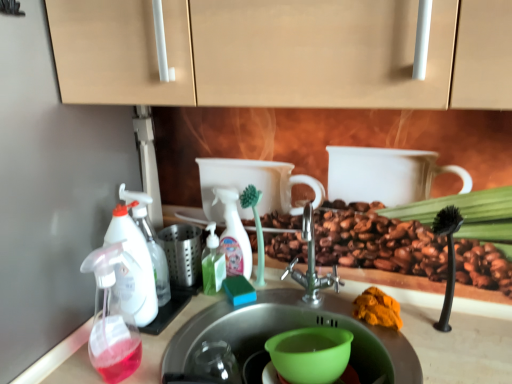
Question: Considering the relative positions of stainless steel sink at center, which is the second sink from bottom to top, and green plastic cup at sink in the image provided, is stainless steel sink at center, which is the second sink from bottom to top, to the right of green plastic cup at sink from the viewer's perspective?

Choices:
 (A) no
 (B) yes

Answer: (A)

Question: From a real-world perspective, is stainless steel sink at center, the 1th sink positioned from the top, positioned under green plastic cup at sink based on gravity?

Choices:
 (A) yes
 (B) no

Answer: (A)

Question: Can you confirm if stainless steel sink at center, which is the second sink from bottom to top, is wider than green plastic cup at sink?

Choices:
 (A) no
 (B) yes

Answer: (B)

Question: Is the position of stainless steel sink at center, the 1th sink positioned from the top, less distant than that of green plastic cup at sink?

Choices:
 (A) yes
 (B) no

Answer: (A)

Question: Is stainless steel sink at center, the 1th sink positioned from the top, bigger than green plastic cup at sink?

Choices:
 (A) yes
 (B) no

Answer: (A)

Question: Considering their positions, is orange powder at sink located in front of or behind translucent plastic soap dispenser at left, positioned as the third soap dispenser in right-to-left order?

Choices:
 (A) front
 (B) behind

Answer: (B)

Question: In terms of width, does orange powder at sink look wider or thinner when compared to translucent plastic soap dispenser at left, which ranks as the second soap dispenser in back-to-front order?

Choices:
 (A) thin
 (B) wide

Answer: (B)

Question: In terms of size, does orange powder at sink appear bigger or smaller than translucent plastic soap dispenser at left, which ranks as the second soap dispenser in back-to-front order?

Choices:
 (A) small
 (B) big

Answer: (A)

Question: Is orange powder at sink to the left or to the right of translucent plastic soap dispenser at left, positioned as the third soap dispenser in right-to-left order, in the image?

Choices:
 (A) right
 (B) left

Answer: (A)

Question: From a real-world perspective, is translucent plastic spray bottle at center positioned above or below orange powder at sink?

Choices:
 (A) below
 (B) above

Answer: (B)

Question: From the image's perspective, relative to orange powder at sink, is translucent plastic spray bottle at center above or below?

Choices:
 (A) below
 (B) above

Answer: (B)

Question: In terms of size, does translucent plastic spray bottle at center appear bigger or smaller than orange powder at sink?

Choices:
 (A) small
 (B) big

Answer: (B)

Question: Would you say translucent plastic spray bottle at center is to the left or to the right of orange powder at sink in the picture?

Choices:
 (A) right
 (B) left

Answer: (B)

Question: Which is correct: translucent plastic soap dispenser at left, the 1th soap dispenser when ordered from left to right, is inside green translucent soap dispenser at center, which is the first soap dispenser from back to front, or outside of it?

Choices:
 (A) outside
 (B) inside

Answer: (A)

Question: From their relative heights in the image, would you say translucent plastic soap dispenser at left, the 1th soap dispenser when ordered from left to right, is taller or shorter than green translucent soap dispenser at center, marked as the first soap dispenser in a right-to-left arrangement?

Choices:
 (A) tall
 (B) short

Answer: (A)